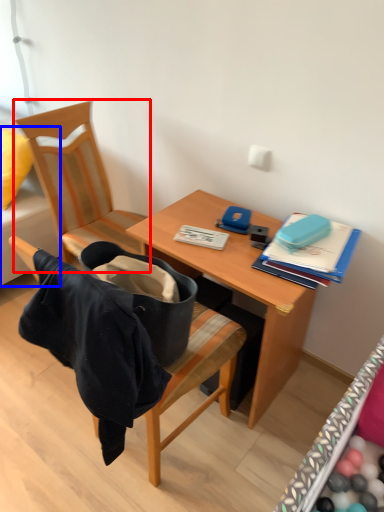
Question: Which object appears closest to the camera in this image, chair (highlighted by a red box) or studio couch (highlighted by a blue box)?

Choices:
 (A) chair
 (B) studio couch

Answer: (A)